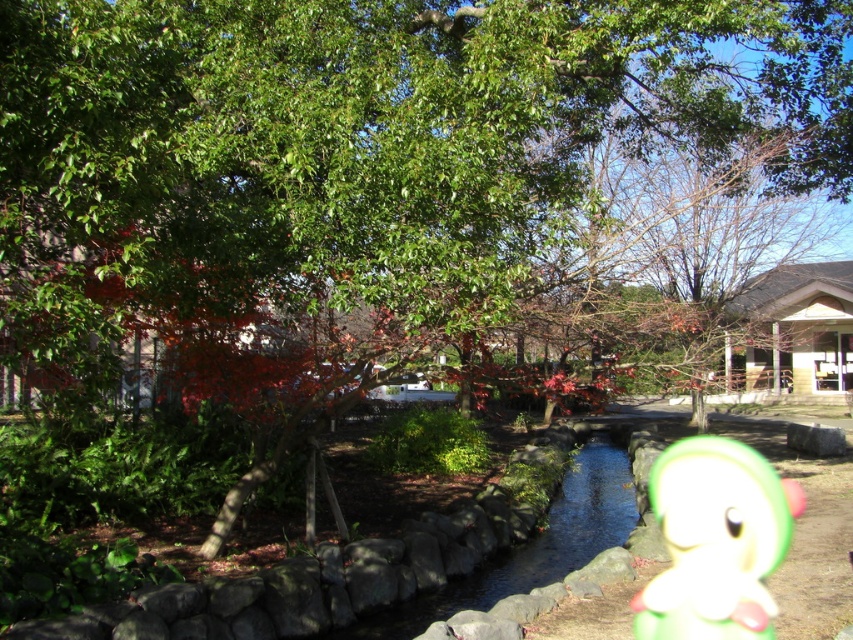
Who is more forward, (770, 557) or (515, 548)?

Point (770, 557) is in front.

Looking at this image, does green matte plush toy at center appear under smooth stone pond at center?

Incorrect, green matte plush toy at center is not positioned below smooth stone pond at center.

The image size is (853, 640). Describe the element at coordinates (715, 541) in the screenshot. I see `green matte plush toy at center` at that location.

At what (x,y) coordinates should I click in order to perform the action: click on green matte plush toy at center. Please return your answer as a coordinate pair (x, y). Looking at the image, I should click on click(715, 541).